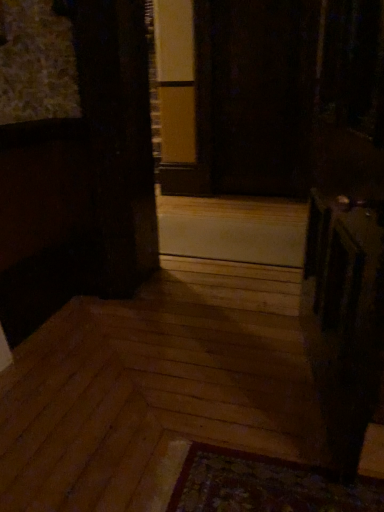
This screenshot has height=512, width=384. Identify the location of unoccupied area in front of transparent glass screen door at center. (254, 207).